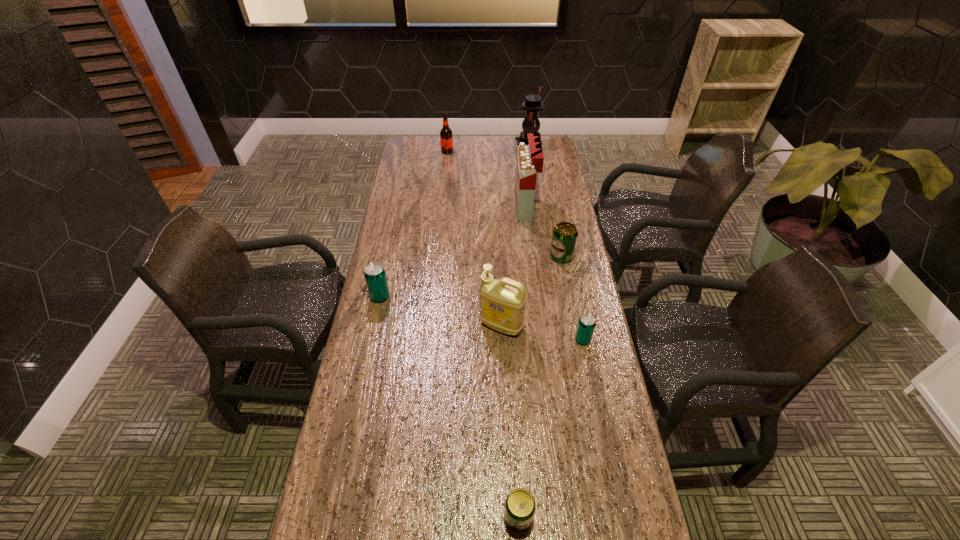
Find the location of a particular element. This screenshot has height=540, width=960. free space that is in between the right green beer can and the second nearest beer can is located at coordinates (572, 298).

Identify the location of object that is the nearest to the root beer. This screenshot has width=960, height=540. (532, 104).

Find the location of `object that is the sixth closest one to the farther teal beer can`. object that is the sixth closest one to the farther teal beer can is located at coordinates (446, 136).

Identify which beer can is the closest to the nearer green beer can. Please provide its 2D coordinates. Your answer should be formatted as a tuple, i.e. [(x, y)], where the tuple contains the x and y coordinates of a point satisfying the conditions above.

[(586, 324)]

You are a GUI agent. You are given a task and a screenshot of the screen. Output one action in this format:
    pyautogui.click(x=<x>, y=<y>)
    Task: Click on the beer can that stands as the third closest to the red cigarette case
    Image resolution: width=960 pixels, height=540 pixels.
    Given the screenshot: What is the action you would take?
    pyautogui.click(x=375, y=276)

Locate an element on the screen. The width and height of the screenshot is (960, 540). vacant space that satisfies the following two spatial constraints: 1. on the front side of the smaller green beer can; 2. on the right side of the fifth farthest object is located at coordinates (334, 517).

Locate an element on the screen. This screenshot has width=960, height=540. vacant space that satisfies the following two spatial constraints: 1. above the right teal beer can, indicating its light source; 2. on the right side of the lantern is located at coordinates pyautogui.click(x=558, y=340).

Where is `free space that satisfies the following two spatial constraints: 1. above the lantern, indicating its light source; 2. on the back side of the nearer teal beer can`? free space that satisfies the following two spatial constraints: 1. above the lantern, indicating its light source; 2. on the back side of the nearer teal beer can is located at coordinates (558, 340).

Where is `vacant space that satisfies the following two spatial constraints: 1. above the black lantern, indicating its light source; 2. on the front side of the beige detergent`? The height and width of the screenshot is (540, 960). vacant space that satisfies the following two spatial constraints: 1. above the black lantern, indicating its light source; 2. on the front side of the beige detergent is located at coordinates (556, 326).